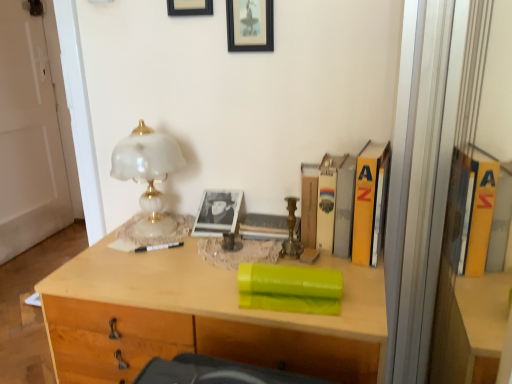
Question: In the image, is green matte book at center, the second book when ordered from back to front, on the left side or the right side of black matte picture frame at upper center, which is the first picture frame from left to right?

Choices:
 (A) left
 (B) right

Answer: (B)

Question: From a real-world perspective, is green matte book at center, acting as the 2th book starting from the top, physically located above or below black matte picture frame at upper center, placed as the second picture frame when sorted from right to left?

Choices:
 (A) below
 (B) above

Answer: (A)

Question: Estimate the real-world distances between objects in this image. Which object is closer to the white glass lamp at upper left?

Choices:
 (A) black matte picture frame at upper center, placed as the second picture frame when sorted from right to left
 (B) green matte book at center, which is the 1th book from front to back
 (C) black framed picture at upper center, which is counted as the first picture frame, starting from the right
 (D) yellow matte book at right
 (E) hardcover book at upper right, the first book in the back-to-front sequence

Answer: (C)

Question: Which is nearer to the green matte book at center, the second book when ordered from back to front?

Choices:
 (A) yellow matte book at right
 (B) black framed picture at upper center, which appears as the 2th picture frame when viewed from the left
 (C) white glossy door at left
 (D) black plastic pen at center
 (E) black matte picture frame at upper center, which is the first picture frame from left to right

Answer: (A)